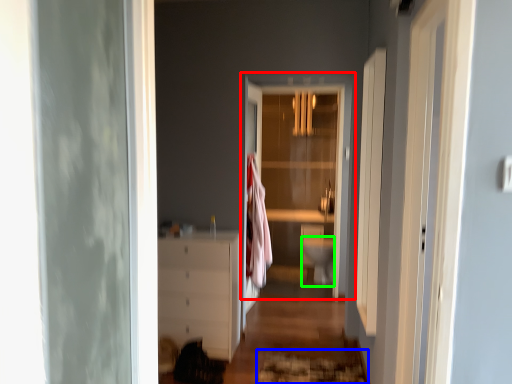
Question: Which object is the farthest from door (highlighted by a red box)? Choose among these: doormat (highlighted by a blue box) or toilet bowl (highlighted by a green box).

Choices:
 (A) doormat
 (B) toilet bowl

Answer: (A)